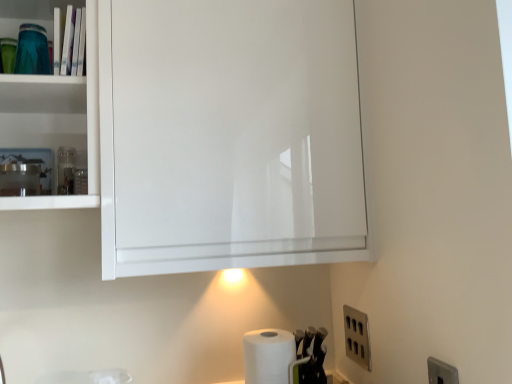
Question: Which is correct: satin nickel outlet at lower right is inside white matte paper towel at lower center, or outside of it?

Choices:
 (A) inside
 (B) outside

Answer: (B)

Question: In terms of height, does satin nickel outlet at lower right look taller or shorter compared to white matte paper towel at lower center?

Choices:
 (A) short
 (B) tall

Answer: (A)

Question: In the image, is satin nickel outlet at lower right positioned in front of or behind white matte paper towel at lower center?

Choices:
 (A) behind
 (B) front

Answer: (A)

Question: Relative to satin nickel outlet at lower right, is white matte paper towel at lower center in front or behind?

Choices:
 (A) front
 (B) behind

Answer: (A)

Question: In terms of size, does white matte paper towel at lower center appear bigger or smaller than satin nickel outlet at lower right?

Choices:
 (A) small
 (B) big

Answer: (B)

Question: Which is correct: white matte paper towel at lower center is inside satin nickel outlet at lower right, or outside of it?

Choices:
 (A) inside
 (B) outside

Answer: (B)

Question: In the image, is white matte paper towel at lower center on the left side or the right side of satin nickel outlet at lower right?

Choices:
 (A) right
 (B) left

Answer: (B)